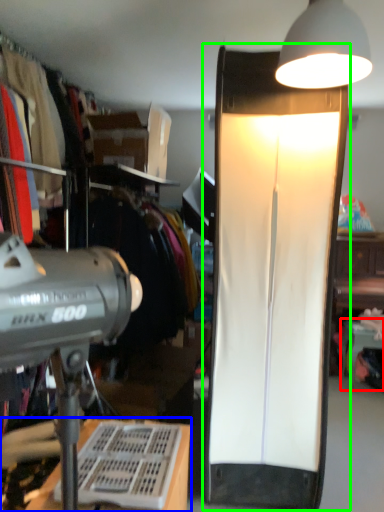
Question: Estimate the real-world distances between objects in this image. Which object is farther from table (highlighted by a red box), desk (highlighted by a blue box) or lamp (highlighted by a green box)?

Choices:
 (A) desk
 (B) lamp

Answer: (A)